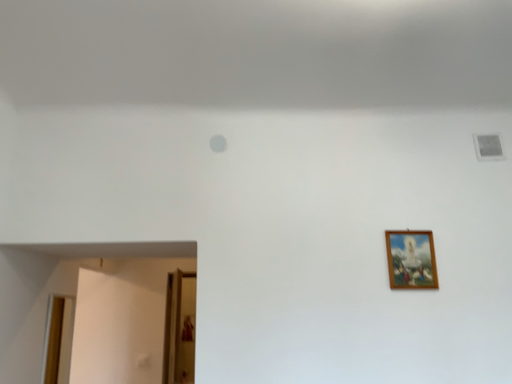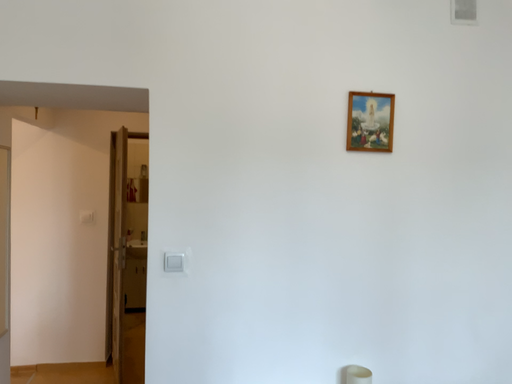
Question: Which way did the camera rotate in the video?

Choices:
 (A) rotated right
 (B) rotated left

Answer: (A)